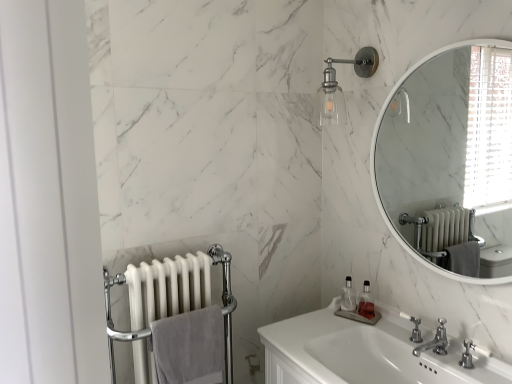
Locate an element on the screen. free region on the left part of clear plastic soap dispenser at lower center, positioned as the 1th soap dispenser in left-to-right order is located at coordinates (315, 317).